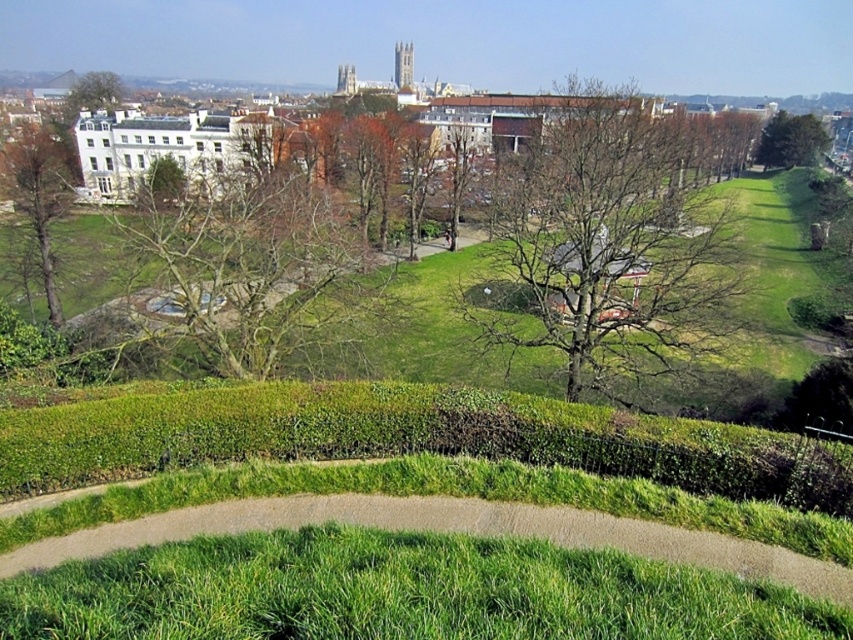
Does green grass at lower center have a smaller size compared to bare wood tree at center?

Indeed, green grass at lower center has a smaller size compared to bare wood tree at center.

Who is taller, green grass at lower center or bare wood tree at center?

With more height is bare wood tree at center.

Does point (222, 576) come farther from viewer compared to point (665, 118)?

No, (222, 576) is closer to viewer.

Image resolution: width=853 pixels, height=640 pixels. Identify the location of green grass at lower center. (398, 593).

Does green leafy tree at upper right appear on the right side of green leafy tree at upper left?

Yes, green leafy tree at upper right is to the right of green leafy tree at upper left.

Who is more forward, (786, 113) or (99, 77)?

Point (99, 77) is more forward.

I want to click on green leafy tree at upper right, so click(x=791, y=140).

Does bare wood tree at center appear over green leafy tree at upper left?

No.

Who is more distant from viewer, (645, 122) or (85, 99)?

Positioned behind is point (85, 99).

You are a GUI agent. You are given a task and a screenshot of the screen. Output one action in this format:
    pyautogui.click(x=<x>, y=<y>)
    Task: Click on the bare wood tree at center
    The height and width of the screenshot is (640, 853).
    Given the screenshot: What is the action you would take?
    pyautogui.click(x=614, y=243)

Find the location of a particular element. The width and height of the screenshot is (853, 640). bare wood tree at center is located at coordinates (614, 243).